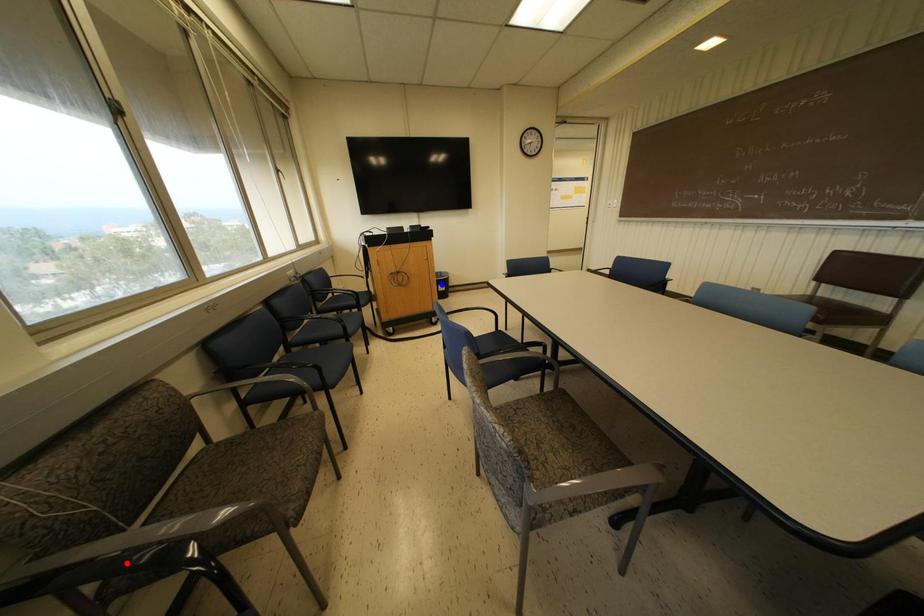
Question: Two points are marked on the image. Which point is closer to the camera?

Choices:
 (A) Blue point is closer.
 (B) Red point is closer.

Answer: (B)